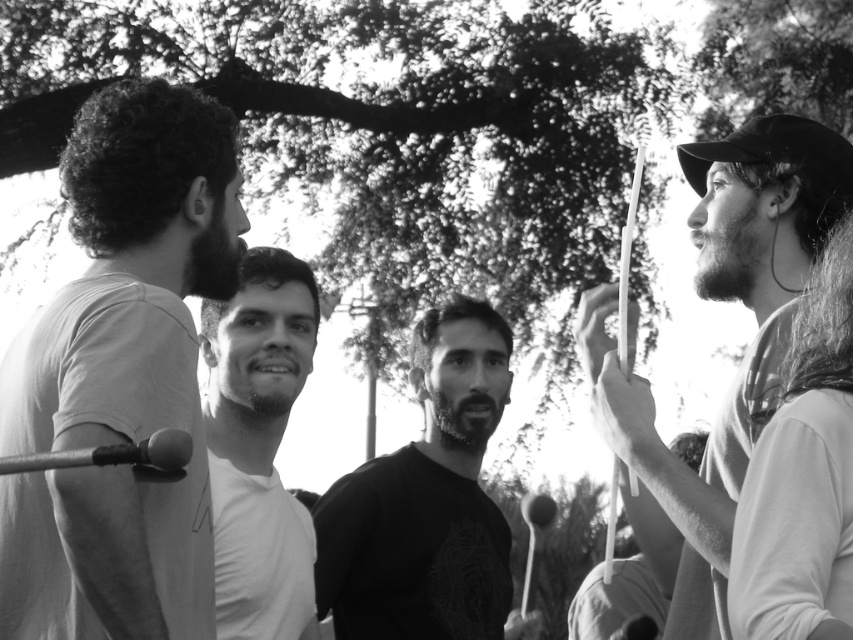
Question: Which point appears farthest from the camera in this image?

Choices:
 (A) (820, 161)
 (B) (302, 552)
 (C) (154, 157)

Answer: (B)

Question: Does smooth white drumstick at right have a greater width compared to smooth white t-shirt at center?

Choices:
 (A) no
 (B) yes

Answer: (B)

Question: Which of the following is the closest to the observer?

Choices:
 (A) (157, 298)
 (B) (653, 509)
 (C) (268, 356)

Answer: (A)

Question: Can you confirm if white matte t-shirt at left is bigger than smooth black shirt at center?

Choices:
 (A) yes
 (B) no

Answer: (A)

Question: Based on their relative distances, which object is nearer to the smooth white t-shirt at center?

Choices:
 (A) white plastic drumstick at right
 (B) white matte t-shirt at left

Answer: (B)

Question: From the image, what is the correct spatial relationship of smooth white t-shirt at center in relation to white plastic drumstick at right?

Choices:
 (A) below
 (B) above

Answer: (B)